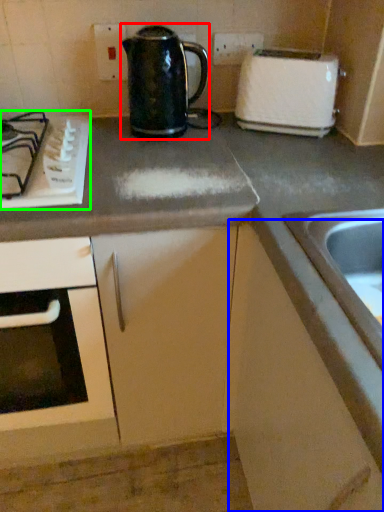
Question: Which object is the closest to the kettle (highlighted by a red box)? Choose among these: cabinetry (highlighted by a blue box) or gas stove (highlighted by a green box).

Choices:
 (A) cabinetry
 (B) gas stove

Answer: (B)